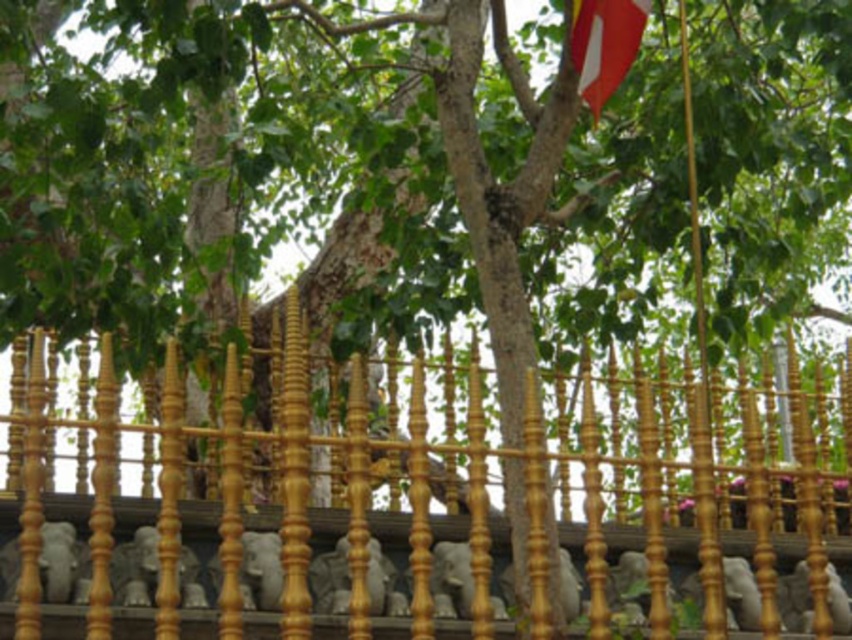
Question: Does gold polished fence at center have a lesser width compared to red fabric flag at upper right?

Choices:
 (A) yes
 (B) no

Answer: (B)

Question: Which object is farther from the camera taking this photo?

Choices:
 (A) red fabric flag at upper right
 (B) gold polished fence at center

Answer: (A)

Question: From the image, what is the correct spatial relationship of gold polished fence at center in relation to red fabric flag at upper right?

Choices:
 (A) below
 (B) above

Answer: (A)

Question: In this image, where is gold polished fence at center located relative to red fabric flag at upper right?

Choices:
 (A) above
 (B) below

Answer: (B)

Question: Which of the following is the closest to the observer?

Choices:
 (A) (585, 397)
 (B) (623, 44)

Answer: (A)